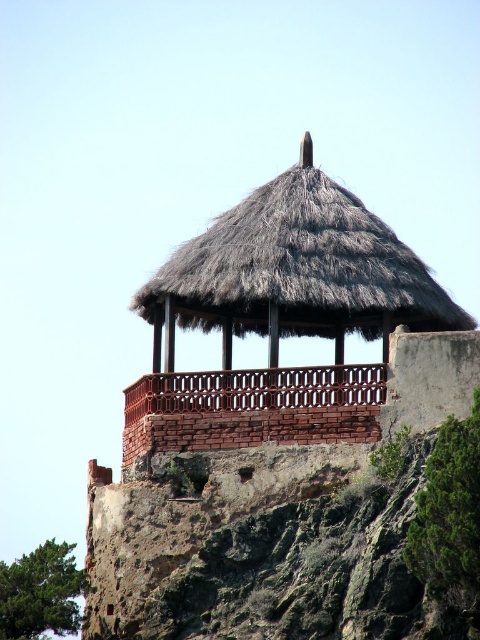
Question: Does thatched wood gazebo at upper center have a lesser width compared to red brick balcony at upper center?

Choices:
 (A) yes
 (B) no

Answer: (B)

Question: Does thatched wood gazebo at upper center appear over red brick balcony at upper center?

Choices:
 (A) no
 (B) yes

Answer: (B)

Question: Is thatched wood gazebo at upper center smaller than red brick balcony at upper center?

Choices:
 (A) no
 (B) yes

Answer: (A)

Question: Among these points, which one is farthest from the camera?

Choices:
 (A) (349, 371)
 (B) (271, 250)

Answer: (B)

Question: Which point is farther to the camera?

Choices:
 (A) red brick balcony at upper center
 (B) thatched wood gazebo at upper center

Answer: (B)